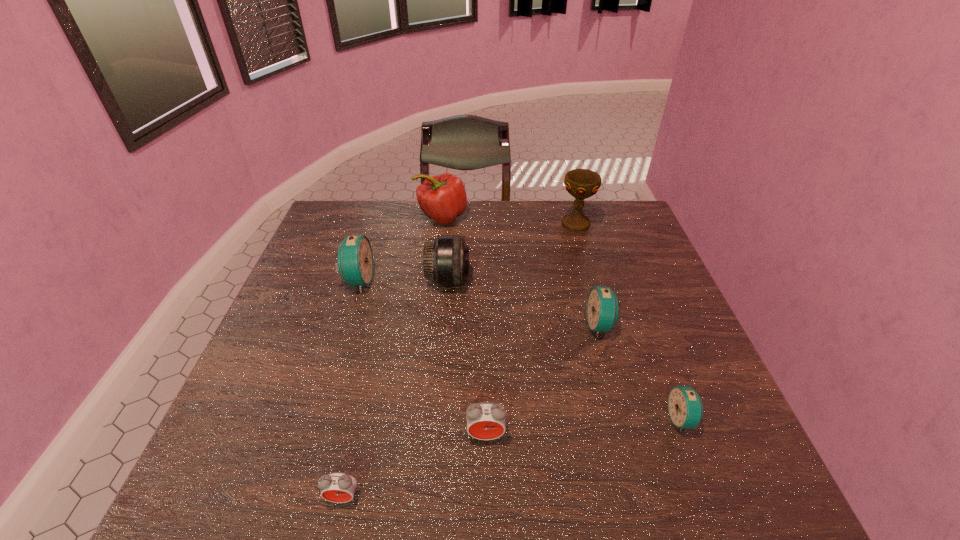
This screenshot has height=540, width=960. What are the coordinates of `object that is at the far right corner` in the screenshot? It's located at (580, 183).

You are a GUI agent. You are given a task and a screenshot of the screen. Output one action in this format:
    pyautogui.click(x=<x>, y=<y>)
    Task: Click on the free space at the far edge of the desktop
    
    Given the screenshot: What is the action you would take?
    pyautogui.click(x=422, y=218)

Where is `vacant area at the near edge of the desktop`? The image size is (960, 540). vacant area at the near edge of the desktop is located at coordinates (423, 469).

At what (x,y) coordinates should I click in order to perform the action: click on free space at the left edge of the desktop. Please return your answer as a coordinate pair (x, y). Image resolution: width=960 pixels, height=540 pixels. Looking at the image, I should click on (293, 301).

Where is `free space at the right edge of the desktop`? This screenshot has height=540, width=960. free space at the right edge of the desktop is located at coordinates (675, 302).

Locate an element on the screen. vacant space at the far left corner of the desktop is located at coordinates 341,232.

Where is `vacant area that lies between the second biggest blue alarm clock and the leftmost object`? This screenshot has height=540, width=960. vacant area that lies between the second biggest blue alarm clock and the leftmost object is located at coordinates (479, 303).

Identify the location of vacant space that's between the left red alarm clock and the rightmost alarm clock. (513, 458).

The height and width of the screenshot is (540, 960). I want to click on vacant area that lies between the rightmost object and the leftmost object, so pos(519,350).

Image resolution: width=960 pixels, height=540 pixels. What are the coordinates of `empty space between the telephoto lens and the smallest blue alarm clock` in the screenshot? It's located at (564, 349).